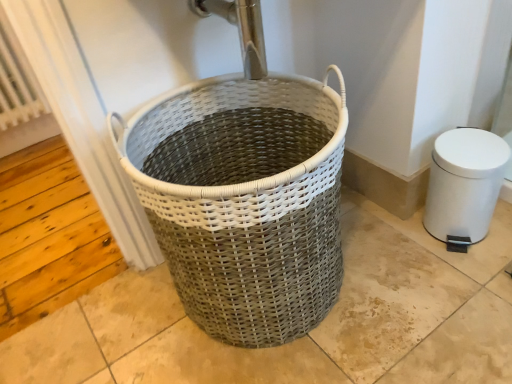
Question: Is white textured radiator at left touching white plastic bidet at right?

Choices:
 (A) no
 (B) yes

Answer: (A)

Question: From a real-world perspective, does white textured radiator at left stand above white plastic bidet at right?

Choices:
 (A) yes
 (B) no

Answer: (A)

Question: Is white textured radiator at left positioned in front of white plastic bidet at right?

Choices:
 (A) no
 (B) yes

Answer: (A)

Question: Would you say white textured radiator at left is outside white plastic bidet at right?

Choices:
 (A) no
 (B) yes

Answer: (B)

Question: Is white textured radiator at left further to the viewer compared to white plastic bidet at right?

Choices:
 (A) yes
 (B) no

Answer: (A)

Question: From the image's perspective, is white textured radiator at left positioned above or below white woven basket at center?

Choices:
 (A) above
 (B) below

Answer: (A)

Question: Would you say white textured radiator at left is inside or outside white woven basket at center?

Choices:
 (A) outside
 (B) inside

Answer: (A)

Question: From a real-world perspective, is white textured radiator at left above or below white woven basket at center?

Choices:
 (A) above
 (B) below

Answer: (A)

Question: Does point (31, 87) appear closer or farther from the camera than point (291, 266)?

Choices:
 (A) farther
 (B) closer

Answer: (A)

Question: Considering the positions of point (325, 264) and point (24, 114), is point (325, 264) closer or farther from the camera than point (24, 114)?

Choices:
 (A) farther
 (B) closer

Answer: (B)

Question: In terms of height, does white woven basket at center look taller or shorter compared to white textured radiator at left?

Choices:
 (A) short
 (B) tall

Answer: (A)

Question: Looking at the image, does white woven basket at center seem bigger or smaller compared to white textured radiator at left?

Choices:
 (A) big
 (B) small

Answer: (A)

Question: Considering the relative positions of white woven basket at center and white textured radiator at left in the image provided, is white woven basket at center to the left or to the right of white textured radiator at left?

Choices:
 (A) left
 (B) right

Answer: (B)

Question: Considering the positions of white textured radiator at left and white plastic bidet at right in the image, is white textured radiator at left wider or thinner than white plastic bidet at right?

Choices:
 (A) thin
 (B) wide

Answer: (A)

Question: Is point (20, 96) closer or farther from the camera than point (482, 155)?

Choices:
 (A) closer
 (B) farther

Answer: (B)